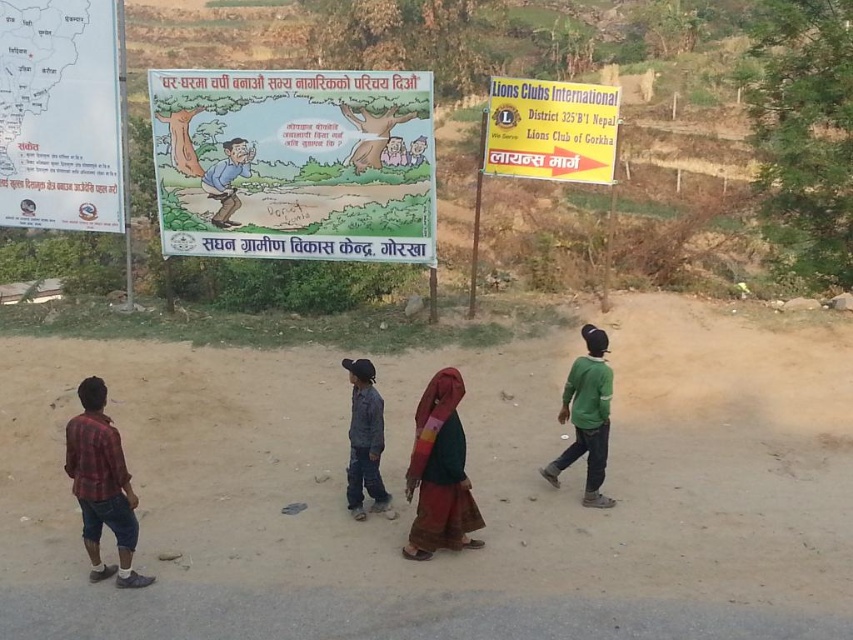
Can you confirm if brown sandy dirt field at lower center is positioned to the right of yellow paper sign at upper right?

Incorrect, brown sandy dirt field at lower center is not on the right side of yellow paper sign at upper right.

Based on the photo, between brown sandy dirt field at lower center and yellow paper sign at upper right, which one has more height?

Standing taller between the two is yellow paper sign at upper right.

Between point (322, 392) and point (583, 179), which one is positioned behind?

Point (583, 179)

Locate an element on the screen. The width and height of the screenshot is (853, 640). brown sandy dirt field at lower center is located at coordinates (473, 483).

Does yellow paper sign at upper right have a greater height compared to green matte shirt at right?

Incorrect, yellow paper sign at upper right's height is not larger of green matte shirt at right's.

Who is shorter, yellow paper sign at upper right or green matte shirt at right?

yellow paper sign at upper right

Find the location of `yellow paper sign at upper right`. yellow paper sign at upper right is located at coordinates (550, 131).

Locate an element on the screen. This screenshot has width=853, height=640. yellow paper sign at upper right is located at coordinates (550, 131).

Which is behind, point (167, 97) or point (492, 115)?

The point (167, 97) is behind.

Can you confirm if matte paper poster at center is positioned to the right of yellow paper sign at upper right?

No, matte paper poster at center is not to the right of yellow paper sign at upper right.

Image resolution: width=853 pixels, height=640 pixels. Describe the element at coordinates (294, 163) in the screenshot. I see `matte paper poster at center` at that location.

Find the location of `matte paper poster at center`. matte paper poster at center is located at coordinates (294, 163).